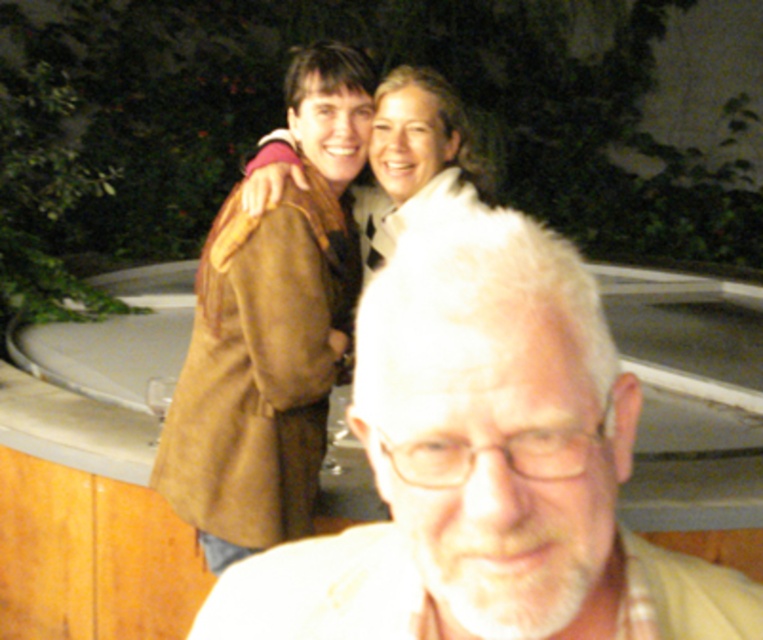
Based on the photo, you are a photographer trying to adjust the lighting for a group photo. You notice the white matte hair at center and the brown suede coat at upper center. Which object should you focus on first if you want to ensure both are well lit?

The white matte hair at center is below brown suede coat at upper center, so you should focus on lighting the brown suede coat at upper center first to ensure it is properly illuminated before adjusting for the lower positioned white matte hair at center.

You are a photographer trying to capture a clear photo of the white matte hair at center and the white fur coat at upper center. Which object should you focus on first if you want to ensure both are in focus?

The white fur coat at upper center should be focused on first because it is closer to the camera than the white matte hair at center, which is further away. By focusing on the closer object, the background object will also be in focus due to the depth of field.